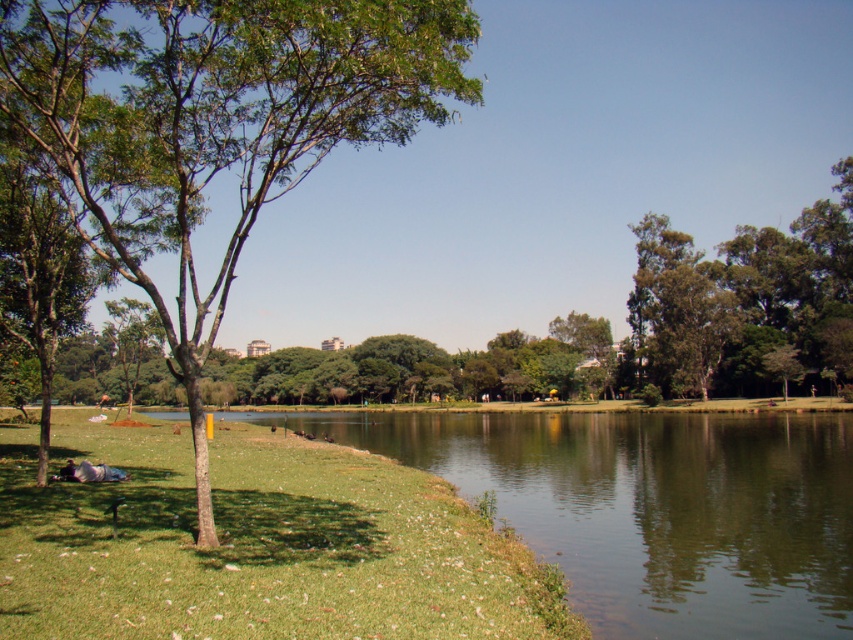
Does point (392, 54) lie in front of point (798, 268)?

Yes, it is in front of point (798, 268).

Looking at this image, which is above, green leafy tree at left or green leafy tree at upper right?

green leafy tree at left

Where is `green leafy tree at left`? green leafy tree at left is located at coordinates (215, 124).

Measure the distance from green grassy at lower left to green leafy tree at left.

green grassy at lower left is 15.61 meters away from green leafy tree at left.

Between point (68, 410) and point (253, 157), which one is positioned in front?

Point (253, 157) is more forward.

Is point (44, 524) farther from camera compared to point (367, 129)?

No, (44, 524) is in front of (367, 129).

Find the location of a particular element. The image size is (853, 640). green grassy at lower left is located at coordinates (254, 545).

Which is below, green grassy at lower left or green leafy tree at upper right?

green grassy at lower left is lower down.

Locate an element on the screen. This screenshot has height=640, width=853. green grassy at lower left is located at coordinates (254, 545).

Is point (172, 596) more distant than point (682, 362)?

No, it is in front of (682, 362).

The width and height of the screenshot is (853, 640). What are the coordinates of `green grassy at lower left` in the screenshot? It's located at (254, 545).